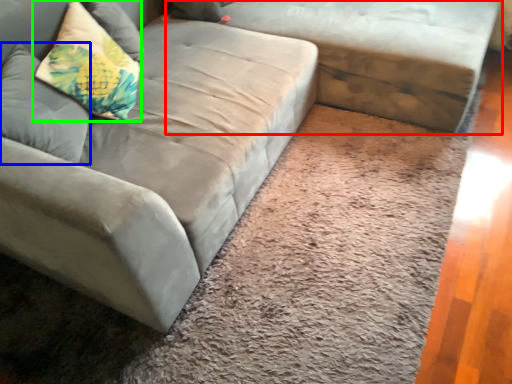
Question: Estimate the real-world distances between objects in this image. Which object is closer to studio couch (highlighted by a red box), pillow (highlighted by a blue box) or pillow (highlighted by a green box)?

Choices:
 (A) pillow
 (B) pillow

Answer: (B)